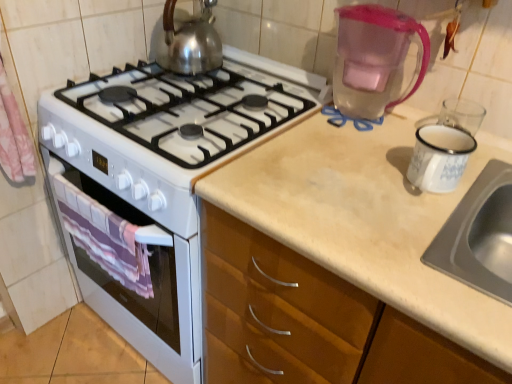
Measure the distance between shiny metallic kettle at upper center and camera.

shiny metallic kettle at upper center is 3.76 feet away from camera.

This screenshot has height=384, width=512. I want to click on transparent plastic pitcher at upper right, so click(374, 58).

Image resolution: width=512 pixels, height=384 pixels. In order to click on purple striped towel at lower left in this screenshot , I will do `click(104, 237)`.

In terms of size, does purple striped towel at lower left appear bigger or smaller than transparent plastic pitcher at upper right?

Considering their sizes, purple striped towel at lower left takes up less space than transparent plastic pitcher at upper right.

Locate an element on the screen. This screenshot has height=384, width=512. coffeepot in front of the purple striped towel at lower left is located at coordinates (374, 58).

In the image, is purple striped towel at lower left on the left side or the right side of transparent plastic pitcher at upper right?

In the image, purple striped towel at lower left appears on the left side of transparent plastic pitcher at upper right.

Considering the relative sizes of purple striped towel at lower left and transparent plastic pitcher at upper right in the image provided, is purple striped towel at lower left shorter than transparent plastic pitcher at upper right?

No, purple striped towel at lower left is not shorter than transparent plastic pitcher at upper right.

Is point (191, 21) positioned in front of point (417, 33)?

That is False.

Does shiny metallic kettle at upper center appear on the left side of transparent plastic pitcher at upper right?

Correct, you'll find shiny metallic kettle at upper center to the left of transparent plastic pitcher at upper right.

Is shiny metallic kettle at upper center aimed at transparent plastic pitcher at upper right?

No, shiny metallic kettle at upper center is not facing towards transparent plastic pitcher at upper right.

Is transparent plastic pitcher at upper right oriented towards purple striped towel at lower left?

No, transparent plastic pitcher at upper right is not oriented towards purple striped towel at lower left.

Locate an element on the screen. The width and height of the screenshot is (512, 384). coffeepot above the purple striped towel at lower left (from the image's perspective) is located at coordinates (374, 58).

Which object is wider, transparent plastic pitcher at upper right or purple striped towel at lower left?

transparent plastic pitcher at upper right is wider.

Is purple striped towel at lower left far away from shiny metallic kettle at upper center?

Actually, purple striped towel at lower left and shiny metallic kettle at upper center are a little close together.

Relative to shiny metallic kettle at upper center, is purple striped towel at lower left in front or behind?

purple striped towel at lower left is positioned closer to the viewer than shiny metallic kettle at upper center.

What's the angular difference between purple striped towel at lower left and shiny metallic kettle at upper center's facing directions?

They differ by 0.00835 degrees in their facing directions.

From a real-world perspective, does purple striped towel at lower left stand above shiny metallic kettle at upper center?

Actually, purple striped towel at lower left is physically below shiny metallic kettle at upper center in the real world.

Can you confirm if transparent plastic pitcher at upper right is shorter than shiny metallic kettle at upper center?

In fact, transparent plastic pitcher at upper right may be taller than shiny metallic kettle at upper center.

Can you tell me how much transparent plastic pitcher at upper right and shiny metallic kettle at upper center differ in facing direction?

There is a 0.00171-degree angle between the facing directions of transparent plastic pitcher at upper right and shiny metallic kettle at upper center.

From the image's perspective, which one is positioned higher, transparent plastic pitcher at upper right or shiny metallic kettle at upper center?

shiny metallic kettle at upper center.

Is shiny metallic kettle at upper center oriented towards purple striped towel at lower left?

No, shiny metallic kettle at upper center is not facing towards purple striped towel at lower left.

Is shiny metallic kettle at upper center not inside purple striped towel at lower left?

Yes, shiny metallic kettle at upper center is outside of purple striped towel at lower left.

Considering the positions of objects shiny metallic kettle at upper center and purple striped towel at lower left in the image provided, who is more to the right, shiny metallic kettle at upper center or purple striped towel at lower left?

shiny metallic kettle at upper center is more to the right.

Does shiny metallic kettle at upper center have a smaller size compared to purple striped towel at lower left?

Incorrect, shiny metallic kettle at upper center is not smaller in size than purple striped towel at lower left.

This screenshot has width=512, height=384. I want to click on cloth below the transparent plastic pitcher at upper right (from the image's perspective), so click(104, 237).

In the image, there is a transparent plastic pitcher at upper right. Where is `kettle above it (from the image's perspective)`? This screenshot has width=512, height=384. kettle above it (from the image's perspective) is located at coordinates (188, 40).

When comparing their distances from shiny metallic kettle at upper center, does transparent plastic pitcher at upper right or purple striped towel at lower left seem closer?

Among the two, transparent plastic pitcher at upper right is located nearer to shiny metallic kettle at upper center.

When comparing their distances from transparent plastic pitcher at upper right, does shiny metallic kettle at upper center or purple striped towel at lower left seem closer?

shiny metallic kettle at upper center lies closer to transparent plastic pitcher at upper right than the other object.

Estimate the real-world distances between objects in this image. Which object is further from transparent plastic pitcher at upper right, purple striped towel at lower left or shiny metallic kettle at upper center?

purple striped towel at lower left.

Estimate the real-world distances between objects in this image. Which object is further from purple striped towel at lower left, shiny metallic kettle at upper center or transparent plastic pitcher at upper right?

transparent plastic pitcher at upper right is further to purple striped towel at lower left.

When comparing their distances from purple striped towel at lower left, does transparent plastic pitcher at upper right or shiny metallic kettle at upper center seem closer?

Based on the image, shiny metallic kettle at upper center appears to be nearer to purple striped towel at lower left.

Which object lies nearer to the anchor point shiny metallic kettle at upper center, purple striped towel at lower left or transparent plastic pitcher at upper right?

transparent plastic pitcher at upper right is positioned closer to the anchor shiny metallic kettle at upper center.

Locate an element on the screen. kettle between purple striped towel at lower left and transparent plastic pitcher at upper right in the horizontal direction is located at coordinates pyautogui.click(x=188, y=40).